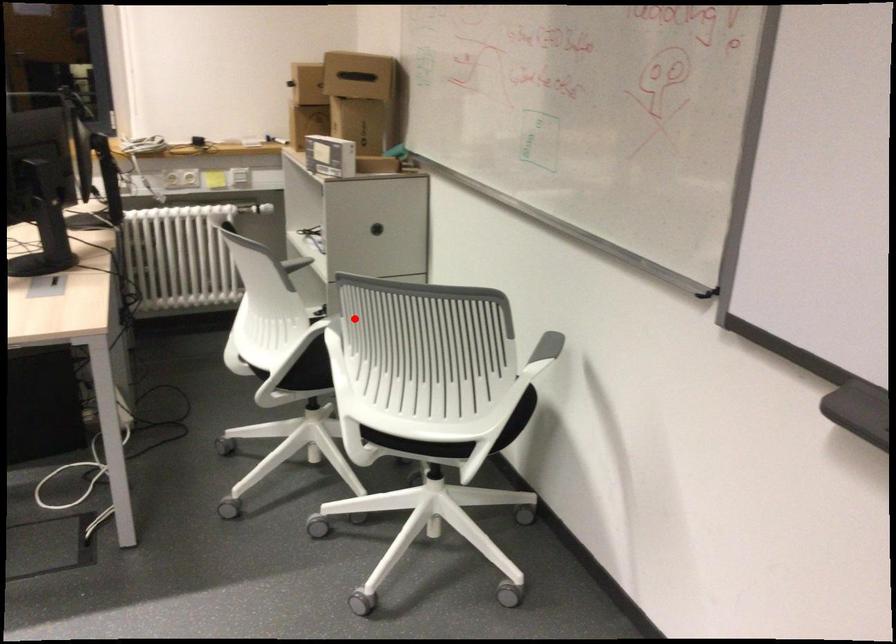
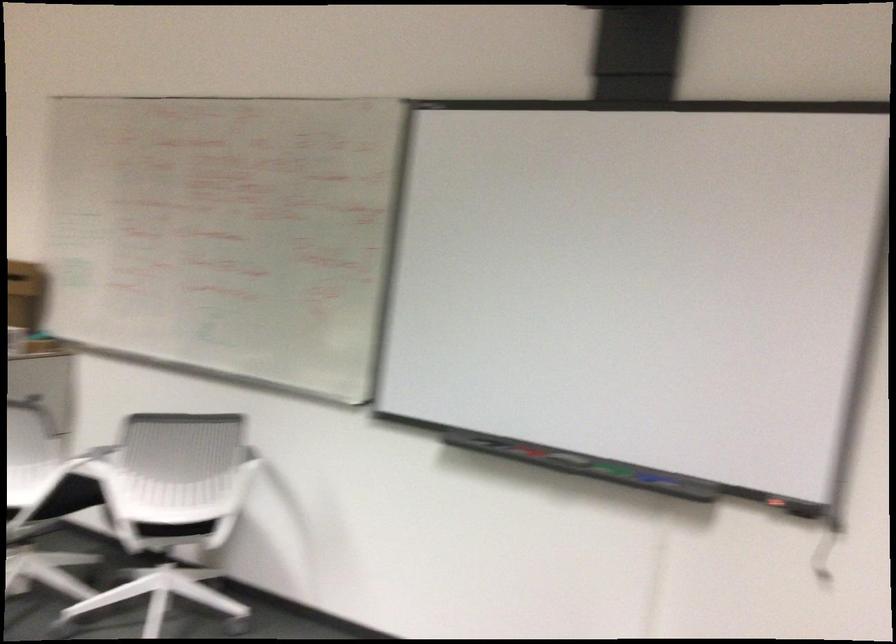
Where in the second image is the point corresponding to the highlighted location from the first image?

(95, 460)